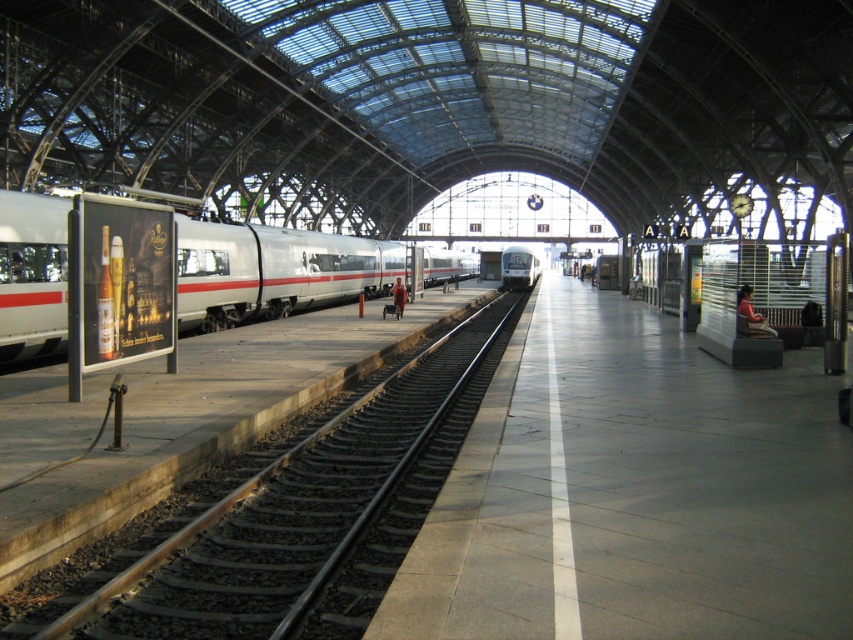
Question: Does smooth steel train track at left have a smaller size compared to silver metallic train at left?

Choices:
 (A) yes
 (B) no

Answer: (A)

Question: Which object is the farthest from the silver metallic train at left?

Choices:
 (A) smooth steel train track at left
 (B) silver metallic train at center

Answer: (B)

Question: Considering the real-world distances, which object is closest to the smooth steel train track at left?

Choices:
 (A) silver metallic train at center
 (B) silver metallic train at left

Answer: (B)

Question: Which object is farther from the camera taking this photo?

Choices:
 (A) silver metallic train at left
 (B) silver metallic train at center

Answer: (B)

Question: Is smooth steel train track at left to the right of silver metallic train at left from the viewer's perspective?

Choices:
 (A) yes
 (B) no

Answer: (A)

Question: Can you confirm if smooth steel train track at left is wider than silver metallic train at center?

Choices:
 (A) no
 (B) yes

Answer: (A)